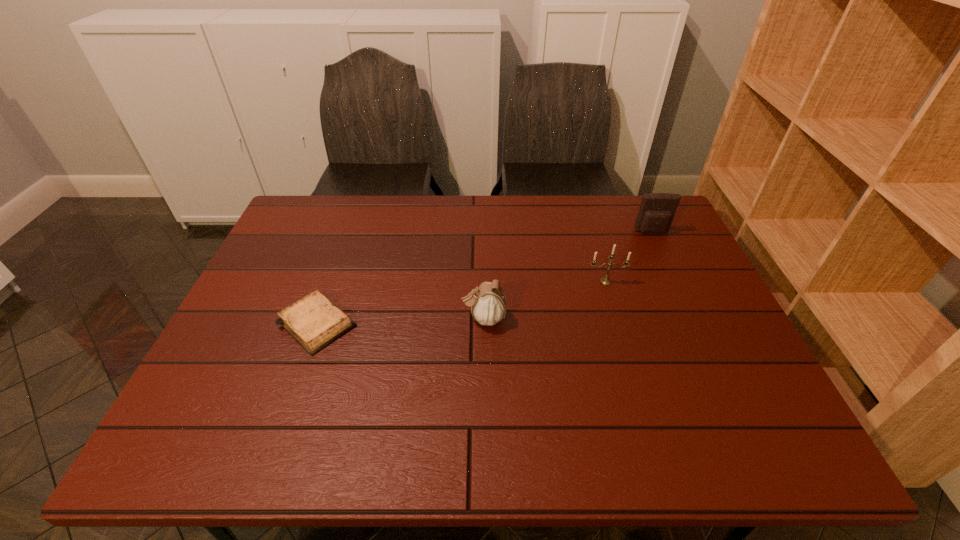
Locate an element on the screen. The image size is (960, 540). vacant space at the right edge of the desktop is located at coordinates (656, 264).

Identify the location of blank space at the near right corner of the desktop. (758, 446).

Locate an element on the screen. The image size is (960, 540). free area in between the right pouch and the leftmost object is located at coordinates (485, 278).

Locate an element on the screen. free area in between the second farthest object and the left pouch is located at coordinates pyautogui.click(x=544, y=300).

The width and height of the screenshot is (960, 540). Identify the location of vacant area that lies between the left pouch and the diary. (400, 321).

Find the location of a particular element. blank region between the third object from right to left and the leftmost object is located at coordinates (400, 321).

Locate an element on the screen. free area in between the second object from left to right and the farthest object is located at coordinates (567, 275).

The height and width of the screenshot is (540, 960). In order to click on free space between the diary and the candle in this screenshot , I will do `click(461, 302)`.

You are a GUI agent. You are given a task and a screenshot of the screen. Output one action in this format:
    pyautogui.click(x=<x>, y=<y>)
    Task: Click on the blank region between the nearer pouch and the right pouch
    
    Given the screenshot: What is the action you would take?
    pyautogui.click(x=567, y=275)

The width and height of the screenshot is (960, 540). Find the location of `blank region between the diary and the second object from right to left`. blank region between the diary and the second object from right to left is located at coordinates (461, 302).